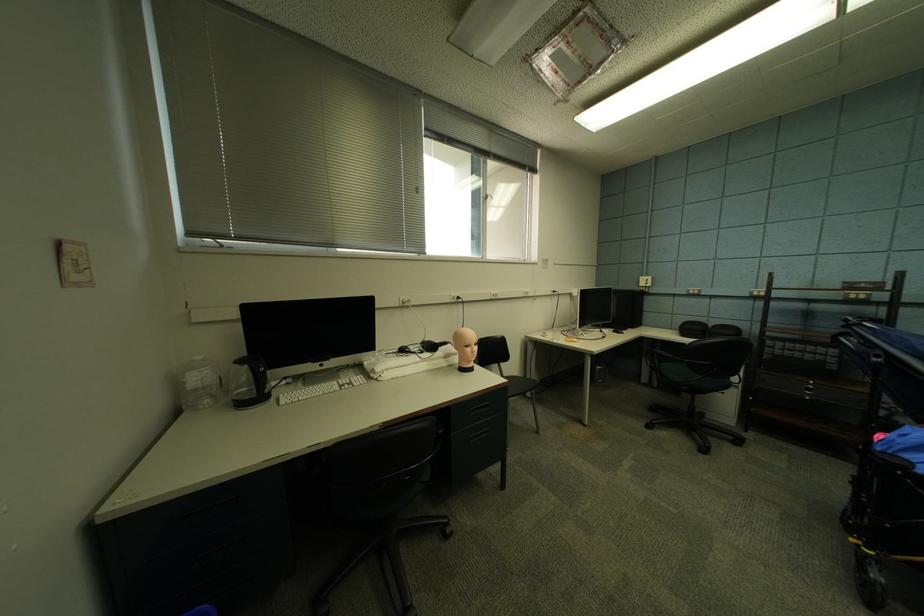
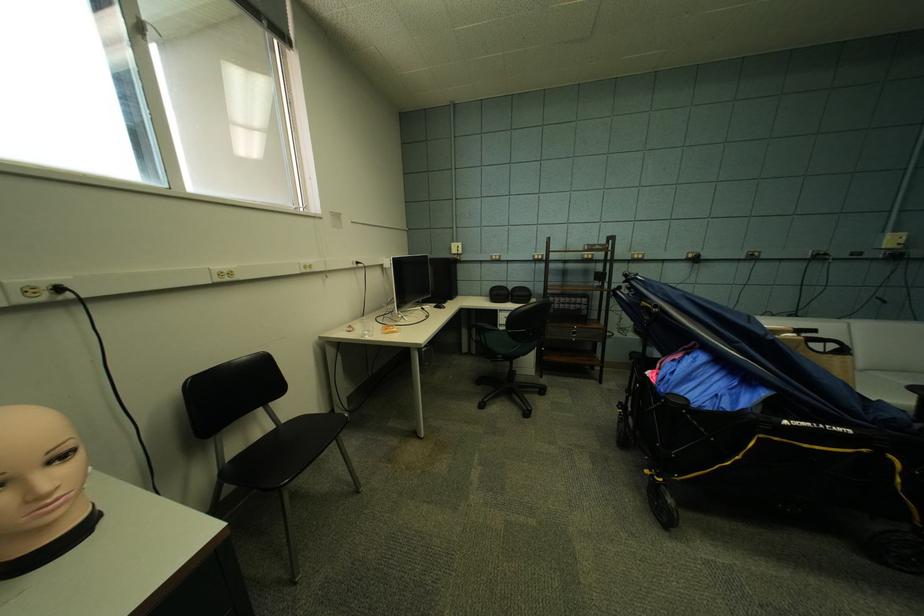
Question: I am providing you with two images of the same scene from different viewpoints. After the viewpoint changes to image2, which objects are now occluded?

Choices:
 (A) office chair armrest
 (B) bag handle
 (C) window latch
 (D) none of these

Answer: (D)